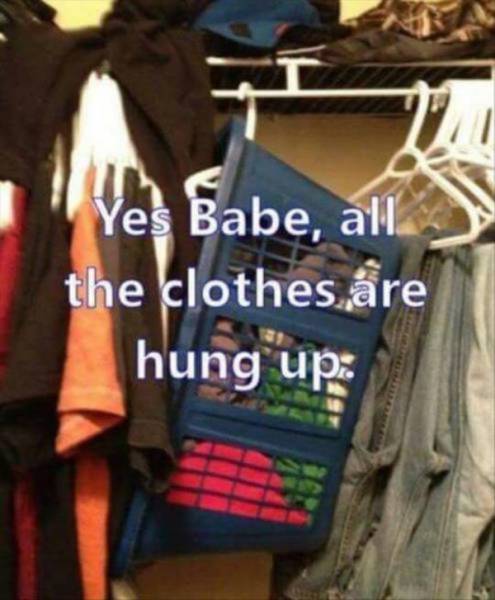
I want to click on clothes on hangers, so click(6, 288), click(35, 301), click(107, 302), click(407, 346), click(442, 345), click(468, 372).